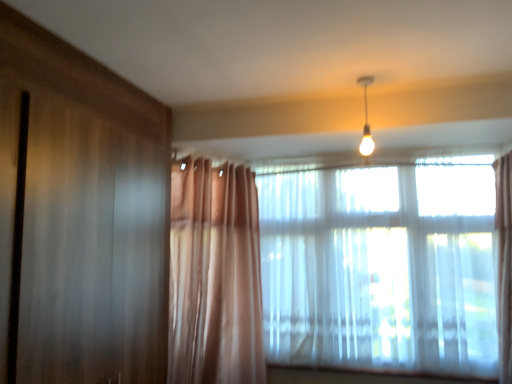
Question: Is translucent fabric window at upper right, placed as the first window when sorted from right to left, not within matte white bulb at upper center?

Choices:
 (A) no
 (B) yes

Answer: (B)

Question: Is translucent fabric window at upper right, acting as the second window starting from the left, to the left of matte white bulb at upper center from the viewer's perspective?

Choices:
 (A) no
 (B) yes

Answer: (A)

Question: Can you confirm if translucent fabric window at upper right, placed as the first window when sorted from right to left, is thinner than matte white bulb at upper center?

Choices:
 (A) yes
 (B) no

Answer: (B)

Question: Does translucent fabric window at upper right, acting as the second window starting from the left, have a smaller size compared to matte white bulb at upper center?

Choices:
 (A) no
 (B) yes

Answer: (A)

Question: From the image's perspective, does translucent fabric window at upper right, placed as the first window when sorted from right to left, appear higher than matte white bulb at upper center?

Choices:
 (A) no
 (B) yes

Answer: (A)

Question: From a real-world perspective, does translucent fabric window at upper right, acting as the second window starting from the left, stand above matte white bulb at upper center?

Choices:
 (A) no
 (B) yes

Answer: (A)

Question: Considering the relative positions of translucent fabric window at upper right, placed as the first window when sorted from right to left, and translucent fabric window at center, the 1th window when ordered from left to right, in the image provided, is translucent fabric window at upper right, placed as the first window when sorted from right to left, to the right of translucent fabric window at center, the 1th window when ordered from left to right, from the viewer's perspective?

Choices:
 (A) no
 (B) yes

Answer: (B)

Question: From a real-world perspective, is translucent fabric window at upper right, placed as the first window when sorted from right to left, physically below translucent fabric window at center, acting as the 2th window starting from the right?

Choices:
 (A) yes
 (B) no

Answer: (A)

Question: Is translucent fabric window at upper right, acting as the second window starting from the left, thinner than translucent fabric window at center, acting as the 2th window starting from the right?

Choices:
 (A) yes
 (B) no

Answer: (B)

Question: Can you confirm if translucent fabric window at upper right, acting as the second window starting from the left, is bigger than translucent fabric window at center, acting as the 2th window starting from the right?

Choices:
 (A) yes
 (B) no

Answer: (A)

Question: Is translucent fabric window at upper right, placed as the first window when sorted from right to left, looking in the opposite direction of translucent fabric window at center, acting as the 2th window starting from the right?

Choices:
 (A) no
 (B) yes

Answer: (A)

Question: Is translucent fabric window at upper right, placed as the first window when sorted from right to left, beside translucent fabric window at center, acting as the 2th window starting from the right?

Choices:
 (A) no
 (B) yes

Answer: (A)

Question: From the image's perspective, does translucent fabric window at center, the 1th window when ordered from left to right, appear lower than matte white bulb at upper center?

Choices:
 (A) no
 (B) yes

Answer: (B)